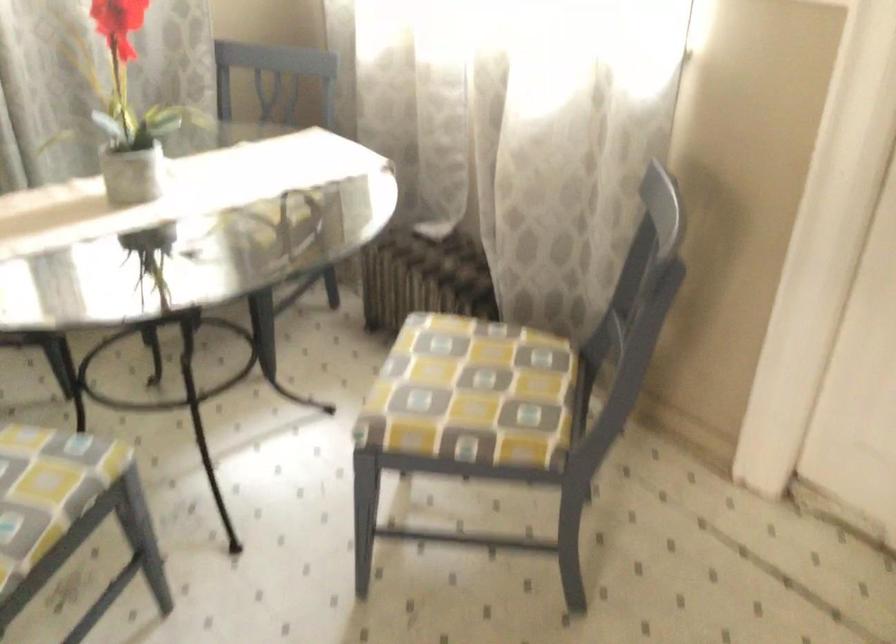
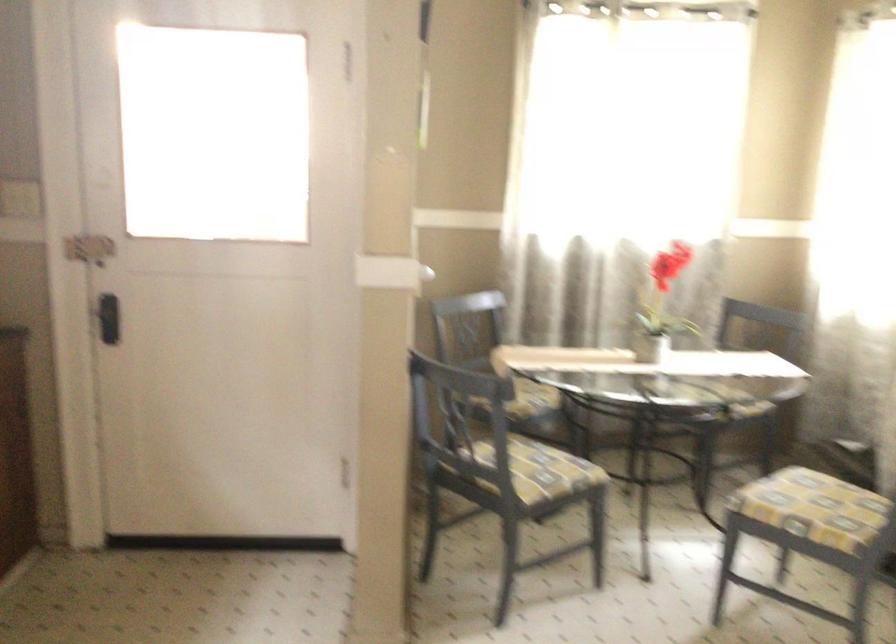
Question: I am providing you with two images of the same scene from different viewpoints. After the viewpoint changes to image2, which objects are now occluded?

Choices:
 (A) black door handle
 (B) small flower pot
 (C) plastic wrapped mattress
 (D) grey flower pot

Answer: (D)